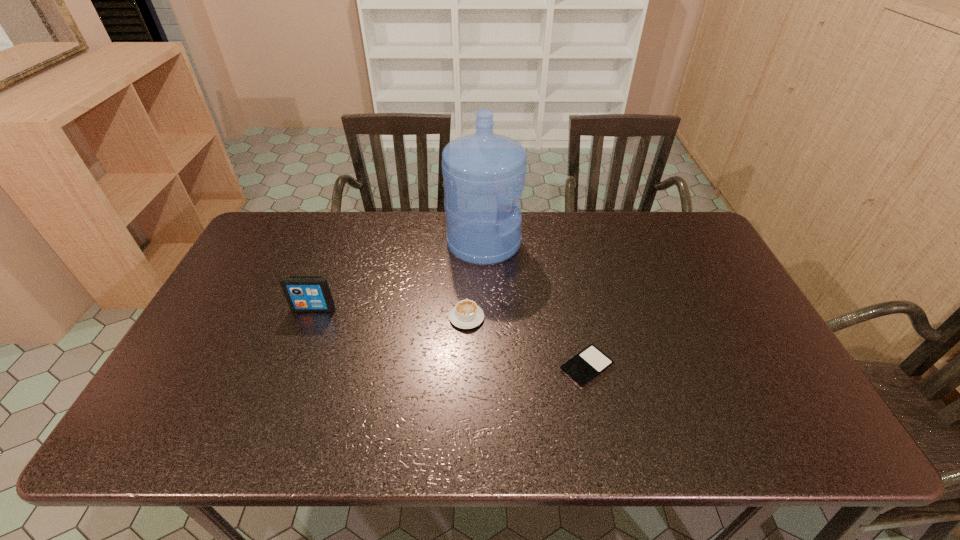
This screenshot has height=540, width=960. Find the location of `vacant area between the tallest object and the shorter iPod`. vacant area between the tallest object and the shorter iPod is located at coordinates (535, 305).

Where is `vacant space that's between the farther iPod and the second shortest object`? vacant space that's between the farther iPod and the second shortest object is located at coordinates (391, 313).

Locate an element on the screen. free space between the third tallest object and the farther iPod is located at coordinates (391, 313).

Locate an element on the screen. Image resolution: width=960 pixels, height=540 pixels. free space between the water jug and the farther iPod is located at coordinates (398, 276).

In order to click on free space between the tallest object and the left iPod in this screenshot , I will do 398,276.

Find the location of a particular element. The image size is (960, 540). vacant space in between the third tallest object and the leftmost object is located at coordinates (391, 313).

The image size is (960, 540). Identify the location of free space between the water jug and the left iPod. (398, 276).

Identify the location of free space between the cappuccino and the farther iPod. The width and height of the screenshot is (960, 540). (391, 313).

The height and width of the screenshot is (540, 960). I want to click on free point between the cappuccino and the nearer iPod, so click(x=527, y=342).

Select which object is the third closest to the farthest object. Please provide its 2D coordinates. Your answer should be formatted as a tuple, i.e. [(x, y)], where the tuple contains the x and y coordinates of a point satisfying the conditions above.

[(303, 293)]